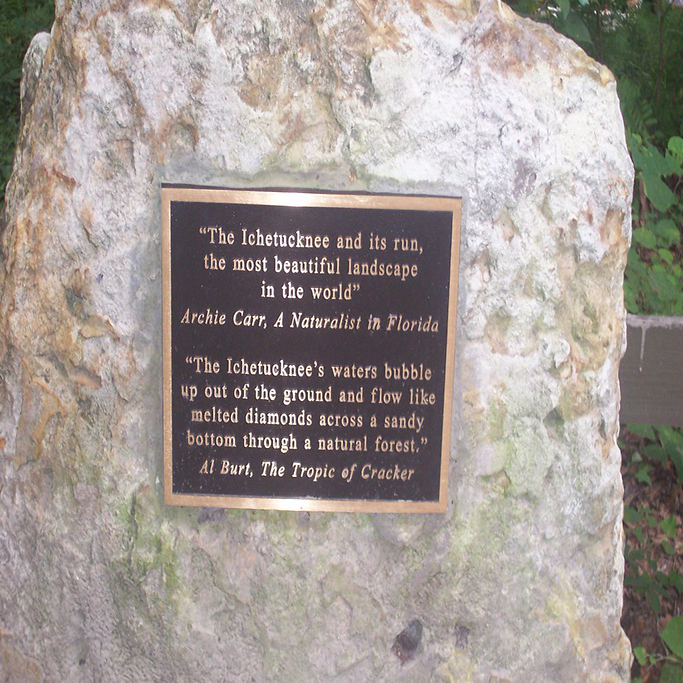
The image size is (683, 683). Find the location of `gold rim of plaque`. gold rim of plaque is located at coordinates (430, 207).